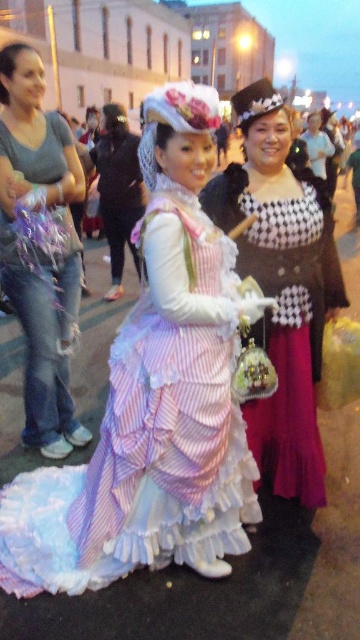
Question: Which is nearer to the pastel striped dress at center?

Choices:
 (A) matte gray jeans at left
 (B) checkered fabric dress at center

Answer: (B)

Question: Is pastel striped dress at center to the left of checkered fabric dress at center from the viewer's perspective?

Choices:
 (A) yes
 (B) no

Answer: (A)

Question: Which is nearer to the checkered fabric dress at center?

Choices:
 (A) pastel striped dress at center
 (B) matte gray jeans at left

Answer: (A)

Question: Observing the image, what is the correct spatial positioning of pastel striped dress at center in reference to matte gray jeans at left?

Choices:
 (A) right
 (B) left

Answer: (A)

Question: Does checkered fabric dress at center have a lesser width compared to matte gray jeans at left?

Choices:
 (A) yes
 (B) no

Answer: (B)

Question: Which object is positioned closest to the checkered fabric dress at center?

Choices:
 (A) matte gray jeans at left
 (B) pastel striped dress at center

Answer: (B)